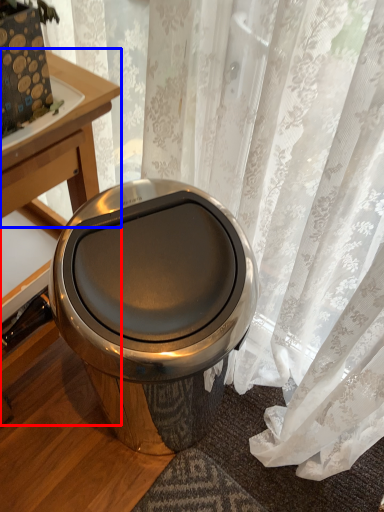
Question: Which of the following is the farthest to the observer, table (highlighted by a red box) or round table (highlighted by a blue box)?

Choices:
 (A) table
 (B) round table

Answer: (B)